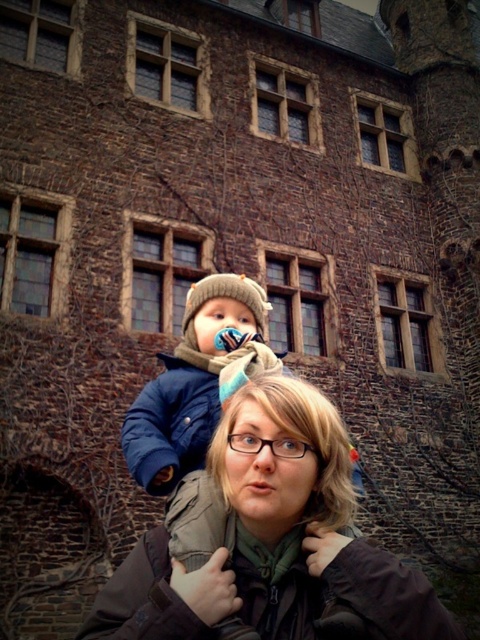
Question: Is green fabric jacket at center positioned before blue fleece jacket at center?

Choices:
 (A) yes
 (B) no

Answer: (A)

Question: Among these objects, which one is farthest from the camera?

Choices:
 (A) blue fleece jacket at center
 (B) green fabric jacket at center

Answer: (A)

Question: Is green fabric jacket at center thinner than blue fleece jacket at center?

Choices:
 (A) no
 (B) yes

Answer: (A)

Question: Is green fabric jacket at center below blue fleece jacket at center?

Choices:
 (A) yes
 (B) no

Answer: (A)